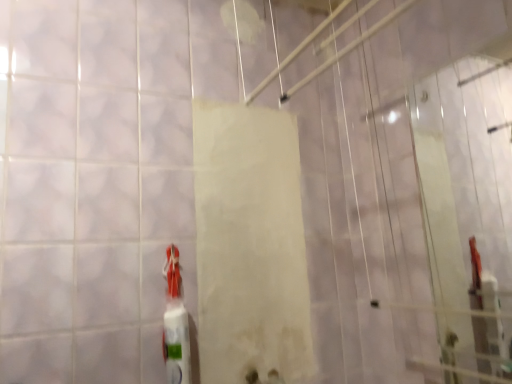
Locate an element on the screen. This screenshot has height=384, width=512. white plastic toothbrush at lower left is located at coordinates (175, 323).

What do you see at coordinates (175, 323) in the screenshot?
I see `white plastic toothbrush at lower left` at bounding box center [175, 323].

At what (x,y) coordinates should I click in order to perform the action: click on white plastic toothbrush at lower left. Please return your answer as a coordinate pair (x, y). Looking at the image, I should click on (175, 323).